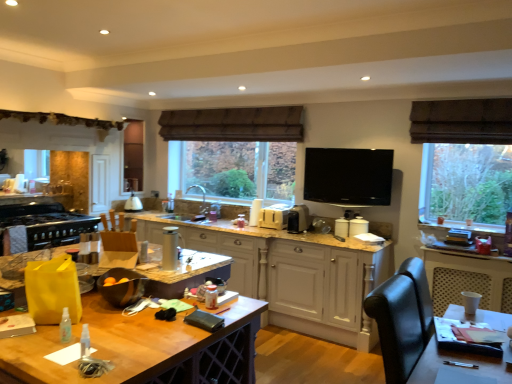
The image size is (512, 384). Identify the location of vacant area that is in front of silver metallic thermos at center, the third appliance from the left. (163, 275).